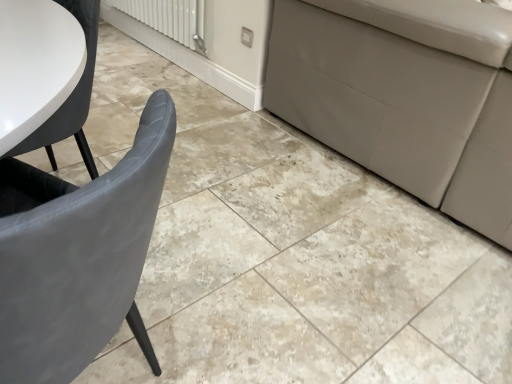
Measure the distance between point (90, 254) and camera.

The distance of point (90, 254) from camera is 18.86 inches.

Identify the location of matte gray chair at left. The width and height of the screenshot is (512, 384). (78, 255).

This screenshot has height=384, width=512. What do you see at coordinates (78, 255) in the screenshot? I see `matte gray chair at left` at bounding box center [78, 255].

Image resolution: width=512 pixels, height=384 pixels. Describe the element at coordinates (169, 19) in the screenshot. I see `white glossy radiator at upper center` at that location.

What is the approximate height of white glossy radiator at upper center?

The height of white glossy radiator at upper center is 12.87 inches.

Identify the location of white glossy radiator at upper center. Image resolution: width=512 pixels, height=384 pixels. (169, 19).

At what (x,y) coordinates should I click in order to perform the action: click on matte gray chair at left. Please return your answer as a coordinate pair (x, y). The image size is (512, 384). Looking at the image, I should click on (78, 255).

Is matte gray chair at left at the right side of white glossy radiator at upper center?

Correct, you'll find matte gray chair at left to the right of white glossy radiator at upper center.

Is the position of matte gray chair at left more distant than that of white glossy radiator at upper center?

No, the depth of matte gray chair at left is less than that of white glossy radiator at upper center.

Which is in front, point (148, 141) or point (179, 29)?

Point (148, 141)

From the image's perspective, which one is positioned higher, matte gray chair at left or white glossy radiator at upper center?

white glossy radiator at upper center is shown above in the image.

From a real-world perspective, between matte gray chair at left and white glossy radiator at upper center, who is vertically higher?

matte gray chair at left is physically above.

Is matte gray chair at left thinner than white glossy radiator at upper center?

No.

Which of these two, matte gray chair at left or white glossy radiator at upper center, stands shorter?

Standing shorter between the two is white glossy radiator at upper center.

Is matte gray chair at left bigger or smaller than white glossy radiator at upper center?

In the image, matte gray chair at left appears to be larger than white glossy radiator at upper center.

Is matte gray chair at left inside the boundaries of white glossy radiator at upper center, or outside?

matte gray chair at left cannot be found inside white glossy radiator at upper center.

Is matte gray chair at left directly adjacent to white glossy radiator at upper center?

No, matte gray chair at left is not making contact with white glossy radiator at upper center.

Is matte gray chair at left positioned with its back to white glossy radiator at upper center?

matte gray chair at left is not turned away from white glossy radiator at upper center.

What's the angular difference between matte gray chair at left and white glossy radiator at upper center's facing directions?

67.9 degrees separate the facing orientations of matte gray chair at left and white glossy radiator at upper center.

You are a GUI agent. You are given a task and a screenshot of the screen. Output one action in this format:
    pyautogui.click(x=<x>, y=<y>)
    Task: Click on the chair below the white glossy radiator at upper center (from the image's perspective)
    
    Given the screenshot: What is the action you would take?
    pyautogui.click(x=78, y=255)

Does white glossy radiator at upper center appear on the right side of matte gray chair at left?

No, white glossy radiator at upper center is not to the right of matte gray chair at left.

Between white glossy radiator at upper center and matte gray chair at left, which one is positioned behind?

Positioned behind is white glossy radiator at upper center.

Which is nearer, (203, 14) or (18, 232)?

Point (203, 14) is positioned farther from the camera compared to point (18, 232).

From the image's perspective, which object appears higher, white glossy radiator at upper center or matte gray chair at left?

From the image's view, white glossy radiator at upper center is above.

From a real-world perspective, is white glossy radiator at upper center located beneath matte gray chair at left?

Yes, from a real-world perspective, white glossy radiator at upper center is below matte gray chair at left.

Is white glossy radiator at upper center wider than matte gray chair at left?

No.

Is white glossy radiator at upper center taller than matte gray chair at left?

In fact, white glossy radiator at upper center may be shorter than matte gray chair at left.

Can you confirm if white glossy radiator at upper center is smaller than matte gray chair at left?

Indeed, white glossy radiator at upper center has a smaller size compared to matte gray chair at left.

Is white glossy radiator at upper center outside of matte gray chair at left?

white glossy radiator at upper center lies outside matte gray chair at left's area.

Is white glossy radiator at upper center positioned far away from matte gray chair at left?

Yes, white glossy radiator at upper center and matte gray chair at left are quite far apart.

Is white glossy radiator at upper center facing towards matte gray chair at left?

No, white glossy radiator at upper center is not aimed at matte gray chair at left.

How many degrees apart are the facing directions of white glossy radiator at upper center and matte gray chair at left?

The angle between the facing direction of white glossy radiator at upper center and the facing direction of matte gray chair at left is 67.9 degrees.

Image resolution: width=512 pixels, height=384 pixels. I want to click on chair positioned vertically above the white glossy radiator at upper center (from a real-world perspective), so click(x=78, y=255).

In the image, there is a matte gray chair at left. Where is `radiator above it (from the image's perspective)`? radiator above it (from the image's perspective) is located at coordinates (169, 19).

Locate an element on the screen. Image resolution: width=512 pixels, height=384 pixels. radiator that is behind the matte gray chair at left is located at coordinates (169, 19).